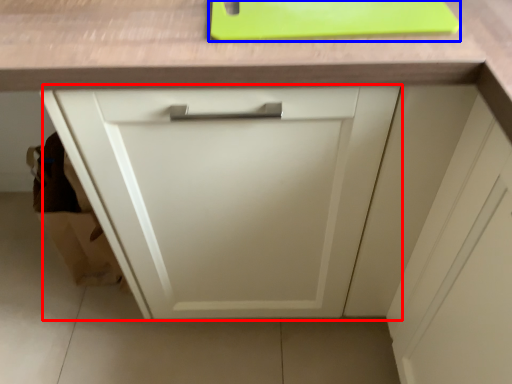
Question: Which point is further to the camera, cabinetry (highlighted by a red box) or cutting board (highlighted by a blue box)?

Choices:
 (A) cabinetry
 (B) cutting board

Answer: (B)